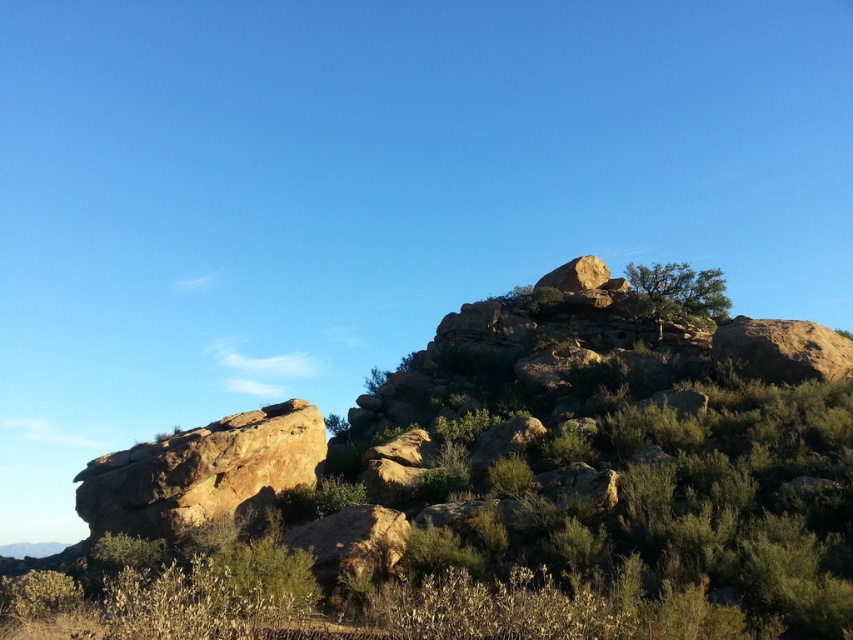
Based on the photo, you are standing at the base of the rocky landscape and want to reach the highest point. You see two points marked in the image. Which point, point (91, 467) or point (569, 289), is closer to you?

Point (91, 467) is closer to the viewer than point (569, 289), so you should head towards point (91, 467) first.

You are navigating a rocky terrain and need to locate the green leafy shrubs at upper center. According to the coordinates provided, where exactly is this shrub positioned in the image?

The green leafy shrubs at upper center is located at point coordinates of 0.769 on the x axis and 0.584 on the y axis.